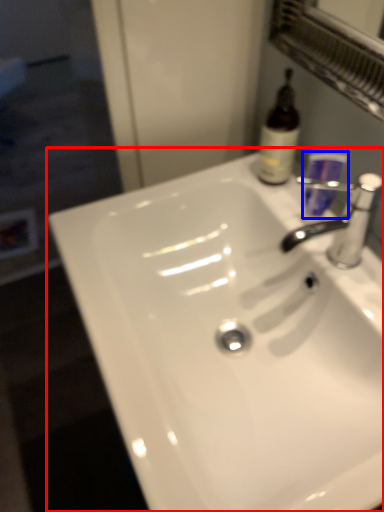
Question: Among these objects, which one is nearest to the camera, sink (highlighted by a red box) or mouthwash (highlighted by a blue box)?

Choices:
 (A) sink
 (B) mouthwash

Answer: (A)